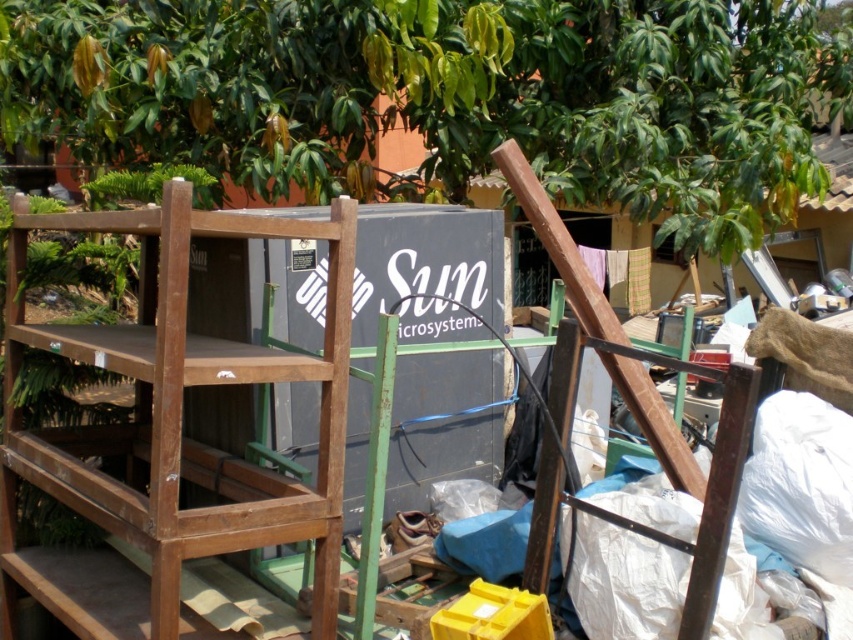
Which of these two, brown wooden bunk bed at center or wooden at right, stands shorter?

Standing shorter between the two is wooden at right.

Between point (212, 451) and point (744, 374), which one is positioned in front?

Point (744, 374)

You are a GUI agent. You are given a task and a screenshot of the screen. Output one action in this format:
    pyautogui.click(x=<x>, y=<y>)
    Task: Click on the brown wooden bunk bed at center
    This screenshot has width=853, height=640.
    Given the screenshot: What is the action you would take?
    pyautogui.click(x=171, y=433)

Measure the distance between brown wooden bunk bed at center and camera.

The distance of brown wooden bunk bed at center from camera is 1.94 meters.

Can you confirm if brown wooden bunk bed at center is positioned above wooden shelf at left?

Incorrect, brown wooden bunk bed at center is not positioned above wooden shelf at left.

Does point (135, 586) come behind point (306, 502)?

Yes, it is.

The height and width of the screenshot is (640, 853). I want to click on brown wooden bunk bed at center, so click(x=171, y=433).

Is point (437, 140) positioned in front of point (656, 401)?

No, (437, 140) is behind (656, 401).

Is green leafy tree at upper center taller than brown wooden bunk bed at center?

No, green leafy tree at upper center is not taller than brown wooden bunk bed at center.

Locate an element on the screen. green leafy tree at upper center is located at coordinates (448, 93).